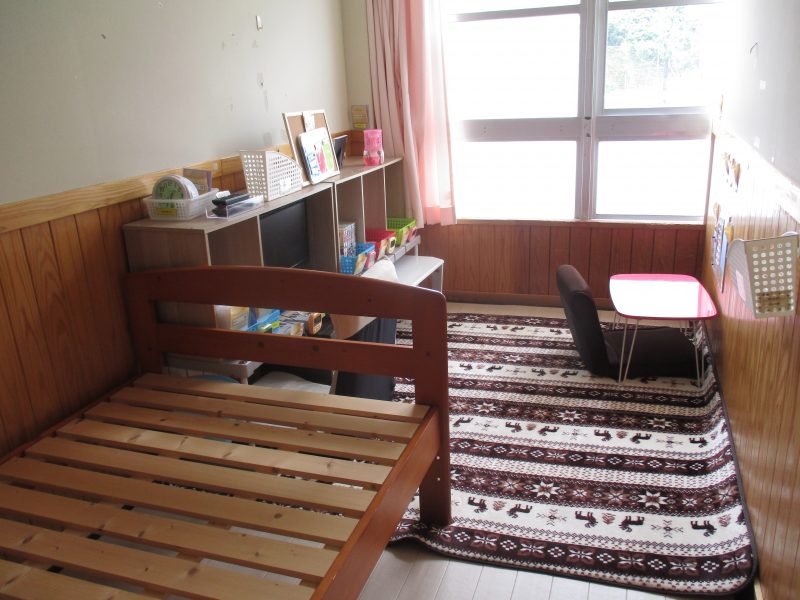
Image resolution: width=800 pixels, height=600 pixels. Identify the location of window. (658, 186), (482, 177), (526, 78), (678, 51).